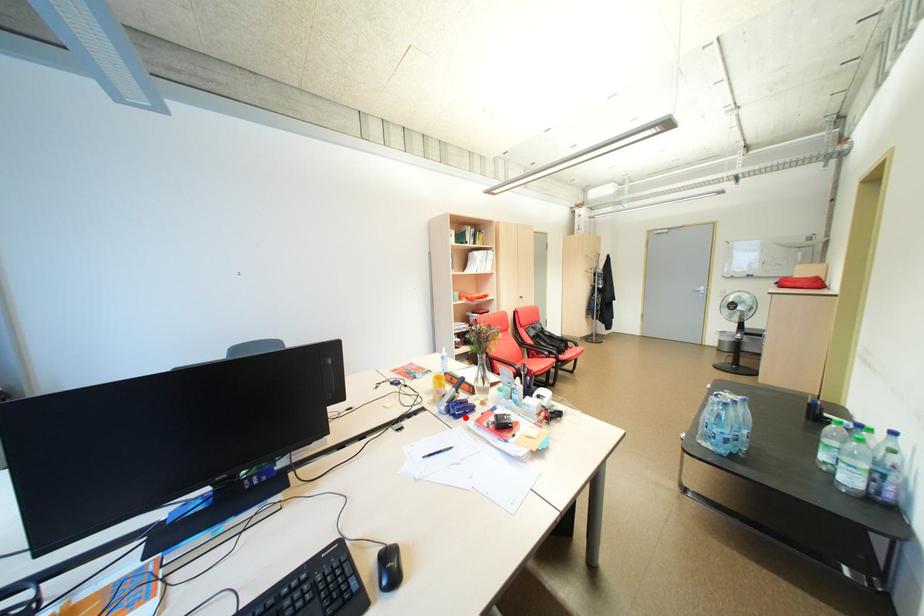
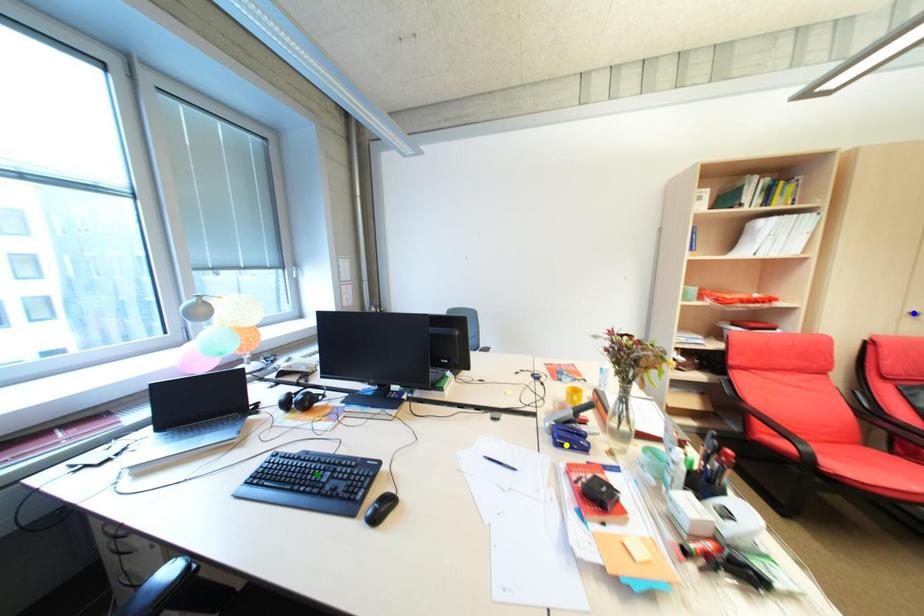
Question: I am providing you with two images of the same scene from different viewpoints. A red point is marked on the first image. You are given multiple points on the second image. Which point in image 2 is actually the same real-world point as the red point in image 1?

Choices:
 (A) blue point
 (B) green point
 (C) yellow point

Answer: (C)